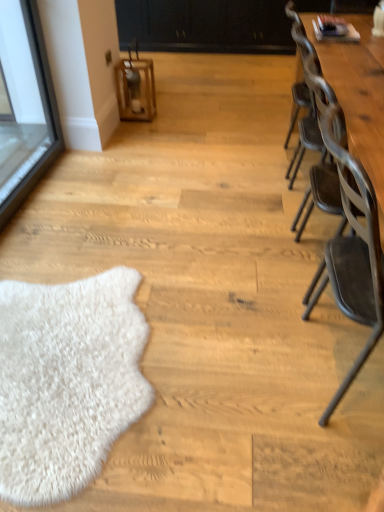
Question: From the image's perspective, is black matte dresser at upper center above metallic gray chair at right?

Choices:
 (A) yes
 (B) no

Answer: (A)

Question: Are black matte dresser at upper center and metallic gray chair at right located far from each other?

Choices:
 (A) no
 (B) yes

Answer: (B)

Question: Is black matte dresser at upper center located outside metallic gray chair at right?

Choices:
 (A) yes
 (B) no

Answer: (A)

Question: Does black matte dresser at upper center appear on the left side of metallic gray chair at right?

Choices:
 (A) no
 (B) yes

Answer: (B)

Question: Is black matte dresser at upper center taller than metallic gray chair at right?

Choices:
 (A) yes
 (B) no

Answer: (B)

Question: From a real-world perspective, is black matte dresser at upper center below metallic gray chair at right?

Choices:
 (A) no
 (B) yes

Answer: (B)

Question: Could you tell me if black matte dresser at upper center is facing wooden table at right?

Choices:
 (A) no
 (B) yes

Answer: (B)

Question: Does black matte dresser at upper center have a greater height compared to wooden table at right?

Choices:
 (A) yes
 (B) no

Answer: (B)

Question: Considering the relative positions of black matte dresser at upper center and wooden table at right in the image provided, is black matte dresser at upper center to the right of wooden table at right from the viewer's perspective?

Choices:
 (A) no
 (B) yes

Answer: (A)

Question: Considering the relative sizes of black matte dresser at upper center and wooden table at right in the image provided, is black matte dresser at upper center shorter than wooden table at right?

Choices:
 (A) no
 (B) yes

Answer: (B)

Question: Does black matte dresser at upper center have a larger size compared to wooden table at right?

Choices:
 (A) yes
 (B) no

Answer: (A)

Question: Is black matte dresser at upper center far away from wooden table at right?

Choices:
 (A) yes
 (B) no

Answer: (A)

Question: Can metallic gray chair at right be found inside wooden table at right?

Choices:
 (A) no
 (B) yes

Answer: (A)